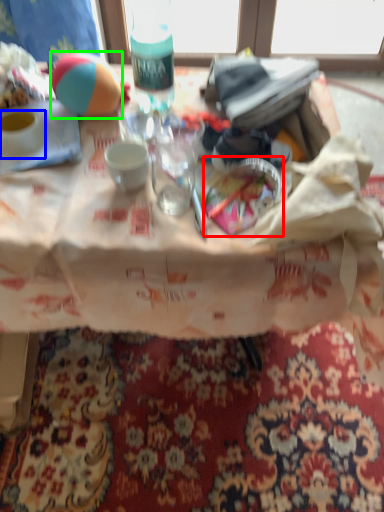
Question: Estimate the real-world distances between objects in this image. Which object is closer to tableware (highlighted by a red box), coffee cup (highlighted by a blue box) or ball (highlighted by a green box)?

Choices:
 (A) coffee cup
 (B) ball

Answer: (B)